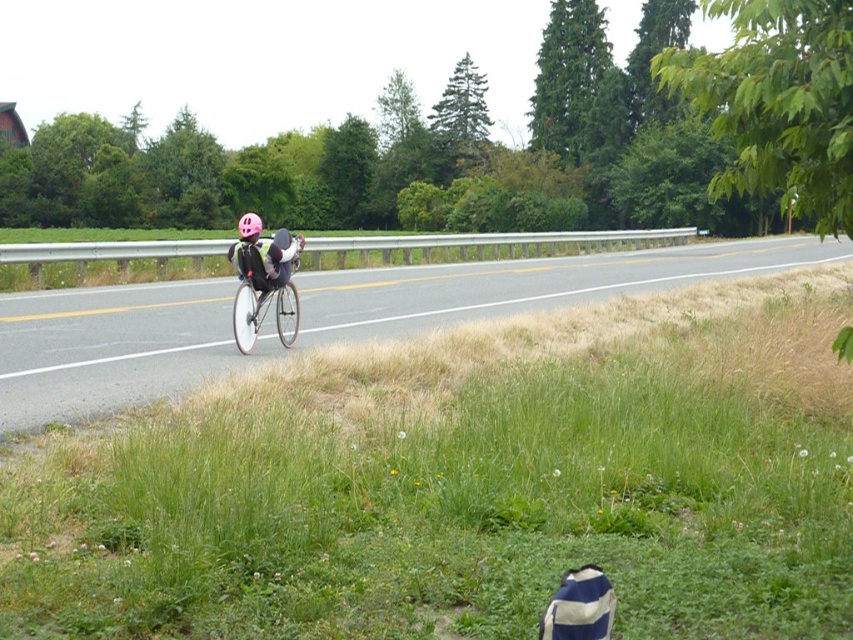
Does shiny silver bicycle at center have a lesser height compared to pink matte helmet at center?

Indeed, shiny silver bicycle at center has a lesser height compared to pink matte helmet at center.

Is shiny silver bicycle at center to the left of pink matte helmet at center from the viewer's perspective?

No, shiny silver bicycle at center is not to the left of pink matte helmet at center.

Does point (244, 342) lie in front of point (245, 237)?

No, it is not.

You are a GUI agent. You are given a task and a screenshot of the screen. Output one action in this format:
    pyautogui.click(x=<x>, y=<y>)
    Task: Click on the shiny silver bicycle at center
    Image resolution: width=853 pixels, height=640 pixels.
    Given the screenshot: What is the action you would take?
    [264, 310]

Based on the photo, who is lower down, asphalt road at center or shiny silver bicycle at center?

shiny silver bicycle at center is lower down.

Does asphalt road at center appear on the left side of shiny silver bicycle at center?

No, asphalt road at center is not to the left of shiny silver bicycle at center.

Where is `asphalt road at center`? asphalt road at center is located at coordinates (113, 348).

Is asphalt road at center thinner than pink matte helmet at center?

No, asphalt road at center is not thinner than pink matte helmet at center.

Who is more distant from viewer, (36, 305) or (239, 236)?

The point (36, 305) is more distant.

The image size is (853, 640). In order to click on asphalt road at center in this screenshot , I will do `click(113, 348)`.